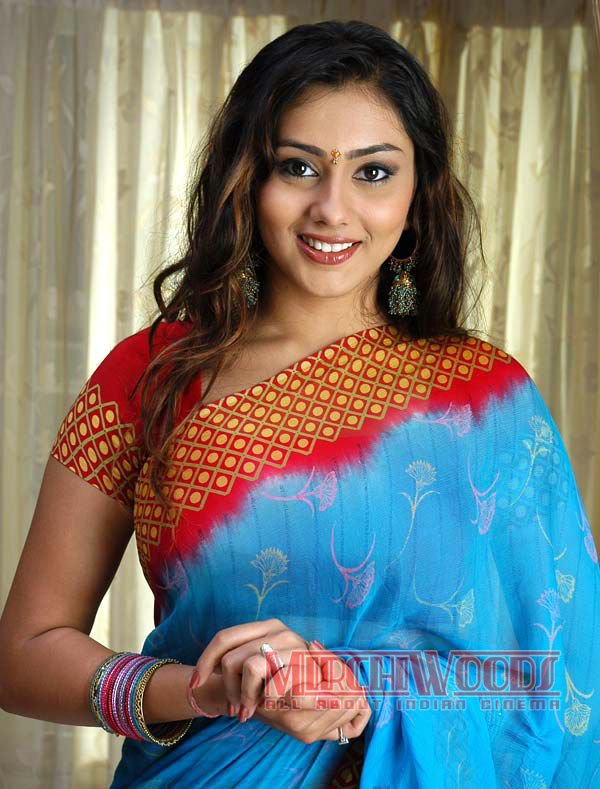
At what (x,y) coordinates should I click in order to perform the action: click on curtain. Please return your answer as a coordinate pair (x, y). Image resolution: width=600 pixels, height=789 pixels. Looking at the image, I should click on (534, 292).